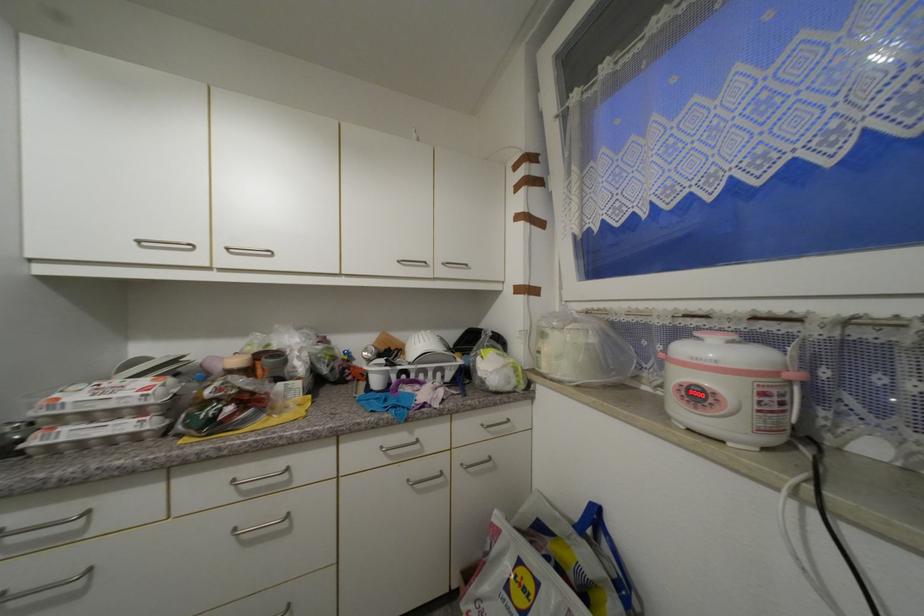
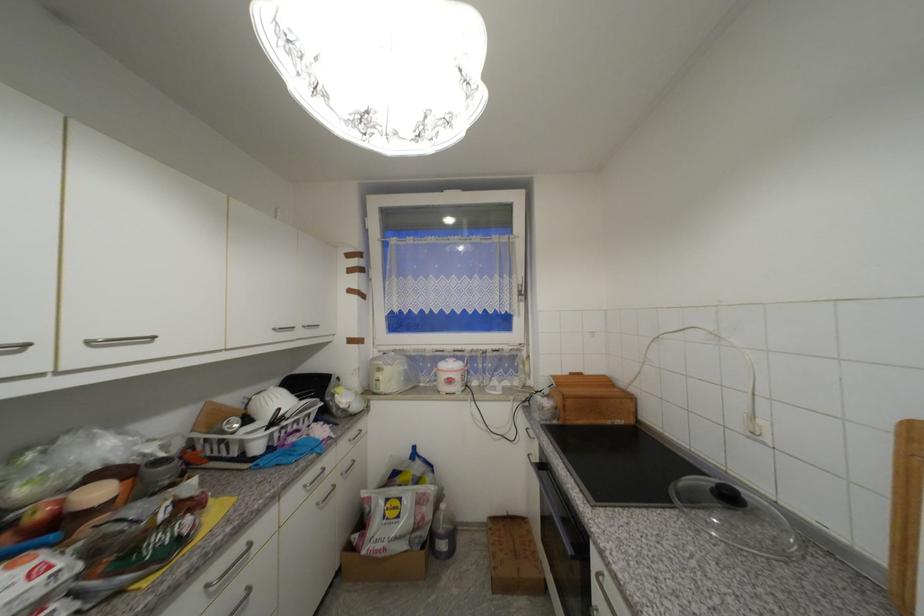
Where in the second image is the point corresponding to pixel 549 336 from the first image?

(385, 371)